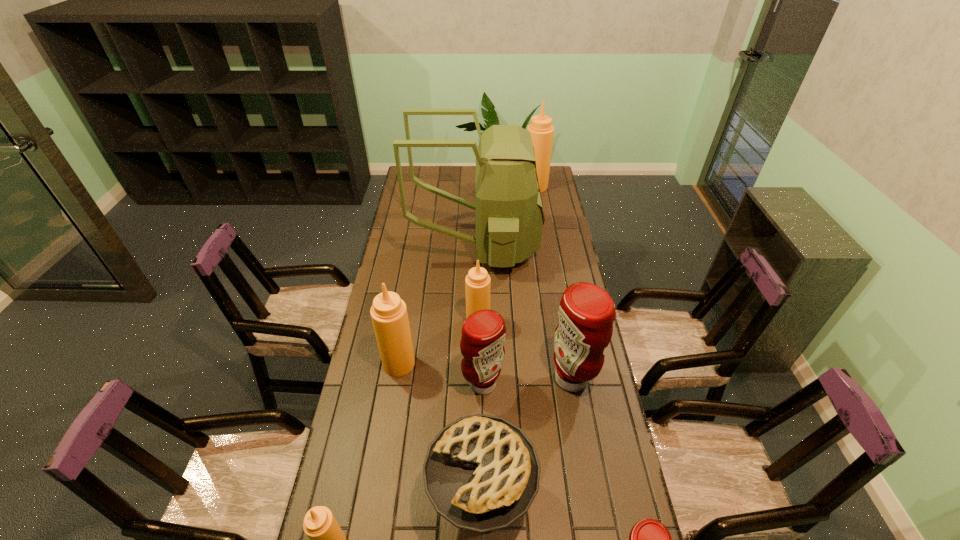
Find the location of a particular element. This screenshot has height=540, width=960. backpack is located at coordinates (509, 216).

In order to click on green backpack in this screenshot , I will do `click(509, 216)`.

This screenshot has width=960, height=540. What are the coordinates of `the biggest tan condiment` in the screenshot? It's located at click(x=542, y=131).

Identify the location of the eighth shortest object. The image size is (960, 540). (542, 131).

Locate an element on the screen. the second nearest tan condiment is located at coordinates (389, 315).

Where is `the third tan condiment from right to left`? The width and height of the screenshot is (960, 540). the third tan condiment from right to left is located at coordinates (389, 315).

This screenshot has height=540, width=960. In order to click on the biggest red condiment in this screenshot , I will do `click(586, 312)`.

At what (x,y) coordinates should I click in order to perform the action: click on the second smallest red condiment. Please return your answer as a coordinate pair (x, y). Looking at the image, I should click on (483, 333).

Locate an element on the screen. This screenshot has height=540, width=960. the third tan condiment from left to right is located at coordinates (477, 283).

Where is `the sixth nearest condiment`? the sixth nearest condiment is located at coordinates (477, 283).